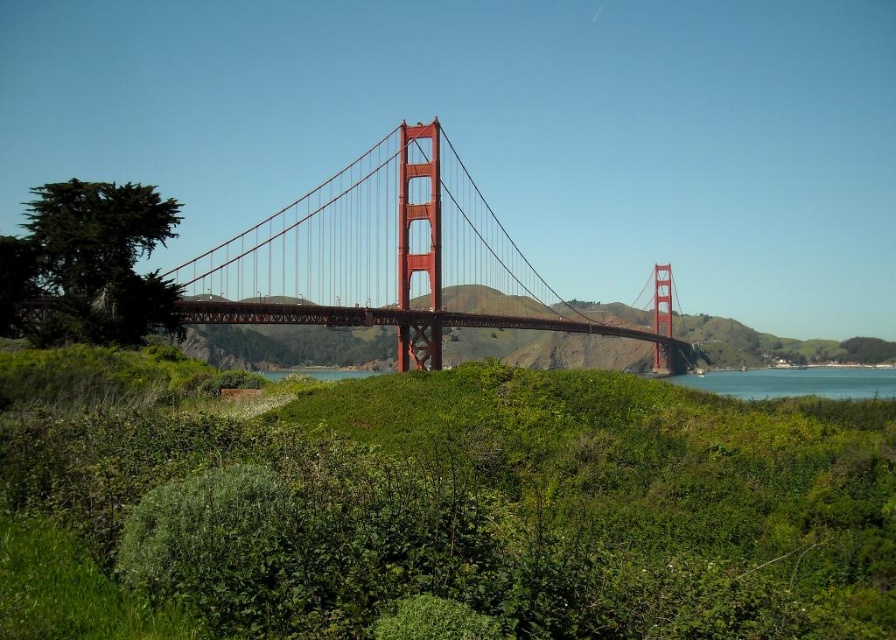
You are standing at the Golden Gate Bridge and see two points marked in the image. The first point is at coordinates point (x=388, y=246) and the second is at point (x=102, y=252). Which point is closer to your eyes?

Point (x=102, y=252) is closer to your eyes because it is nearer to the camera compared to point (x=388, y=246), which is further away.

In the scene shown: You are standing at the camera position and want to reach the point at coordinates point (x=349, y=396). If you walk straight ahead, will you reach that point?

The point point (x=349, y=396) is 83.11 meters away from the camera. Since you are walking straight ahead from the camera position, you will reach the point point (x=349, y=396) after walking 83.11 meters.

You are standing at the observation deck of the Golden Gate Bridge. You see a point labeled as point (392,259). What object does this point correspond to?

Point (392,259) corresponds to the glossy steel bridge at center.